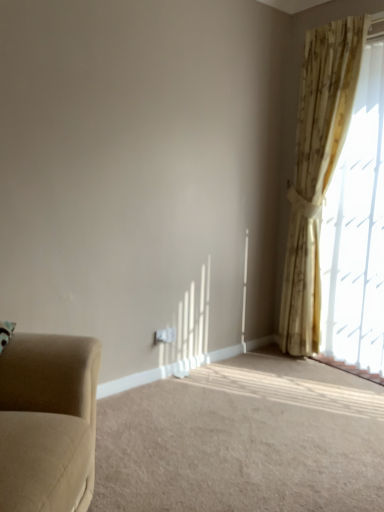
Question: Is suede-like beige armchair at lower left thinner than beige fabric studio couch at left?

Choices:
 (A) no
 (B) yes

Answer: (A)

Question: Does suede-like beige armchair at lower left have a larger size compared to beige fabric studio couch at left?

Choices:
 (A) no
 (B) yes

Answer: (A)

Question: Is suede-like beige armchair at lower left with beige fabric studio couch at left?

Choices:
 (A) yes
 (B) no

Answer: (B)

Question: Can you confirm if suede-like beige armchair at lower left is positioned to the left of beige fabric studio couch at left?

Choices:
 (A) no
 (B) yes

Answer: (A)

Question: From a real-world perspective, does suede-like beige armchair at lower left stand above beige fabric studio couch at left?

Choices:
 (A) yes
 (B) no

Answer: (B)

Question: Is beige fabric studio couch at left wider or thinner than suede-like beige armchair at lower left?

Choices:
 (A) thin
 (B) wide

Answer: (A)

Question: Is point (92, 349) closer or farther from the camera than point (302, 498)?

Choices:
 (A) farther
 (B) closer

Answer: (B)

Question: From the image's perspective, is beige fabric studio couch at left positioned above or below suede-like beige armchair at lower left?

Choices:
 (A) above
 (B) below

Answer: (A)

Question: Is beige fabric studio couch at left inside or outside of suede-like beige armchair at lower left?

Choices:
 (A) inside
 (B) outside

Answer: (B)

Question: Considering their positions, is beige floral curtain at upper right located in front of or behind beige fabric studio couch at left?

Choices:
 (A) front
 (B) behind

Answer: (B)

Question: From a real-world perspective, relative to beige fabric studio couch at left, is beige floral curtain at upper right vertically above or below?

Choices:
 (A) above
 (B) below

Answer: (A)

Question: Considering the relative positions of beige floral curtain at upper right and beige fabric studio couch at left in the image provided, is beige floral curtain at upper right to the left or to the right of beige fabric studio couch at left?

Choices:
 (A) right
 (B) left

Answer: (A)

Question: Considering the positions of beige floral curtain at upper right and beige fabric studio couch at left in the image, is beige floral curtain at upper right taller or shorter than beige fabric studio couch at left?

Choices:
 (A) tall
 (B) short

Answer: (A)

Question: In the image, is beige floral curtain at upper right positioned in front of or behind suede-like beige armchair at lower left?

Choices:
 (A) front
 (B) behind

Answer: (B)

Question: Considering the positions of beige floral curtain at upper right and suede-like beige armchair at lower left in the image, is beige floral curtain at upper right taller or shorter than suede-like beige armchair at lower left?

Choices:
 (A) tall
 (B) short

Answer: (A)